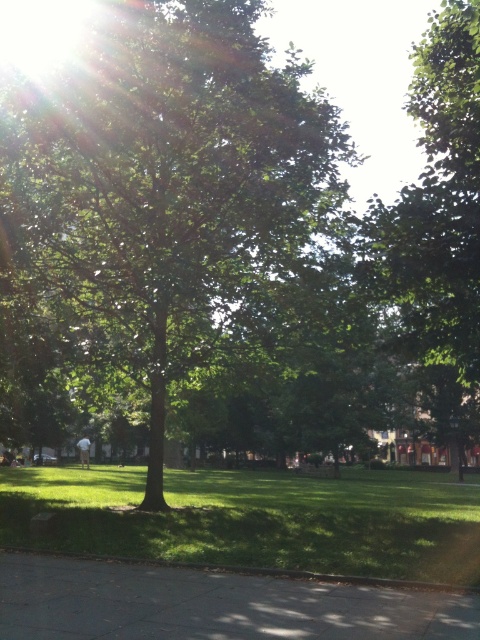
You are standing on the gray concrete pavement at lower center and want to walk towards the green leafy tree at center. Which direction should you face to walk directly towards it?

Since the green leafy tree at center is to the left of gray concrete pavement at lower center, you should face to the left to walk directly towards it.

Looking at this image, you are a gardener who needs to plant a new tree in the park. You see the green leafy tree at center and the gray concrete pavement at lower center. Which area is more suitable for planting a new tree?

The green leafy tree at center is bigger than the gray concrete pavement at lower center, so the area around the green leafy tree at center is more suitable for planting a new tree since it has space and soil available, unlike the paved area.